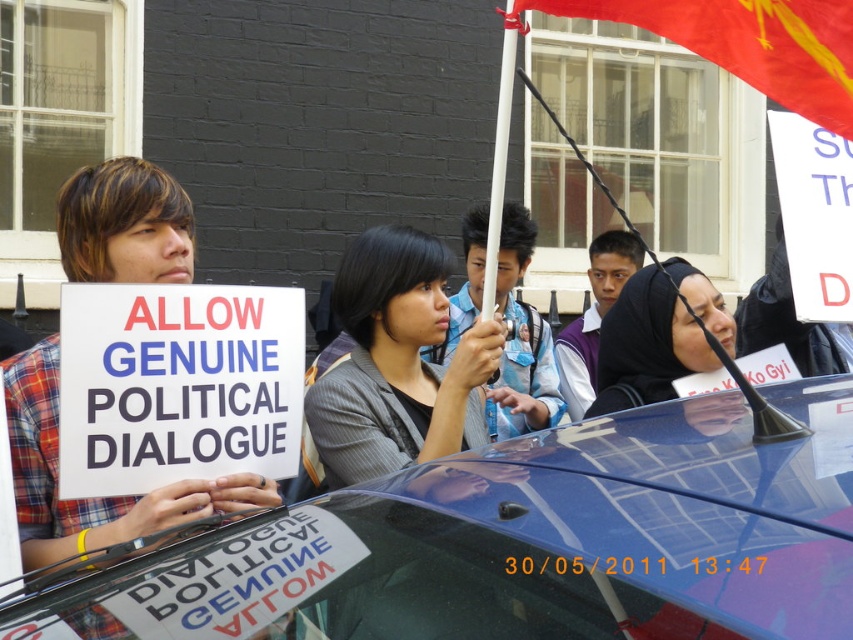
Question: Estimate the real-world distances between objects in this image. Which object is farther from the gray textured blazer at center?

Choices:
 (A) red fabric flag at upper right
 (B) matte black hijab at center

Answer: (A)

Question: In this image, where is shiny blue car at center located relative to matte black hijab at center?

Choices:
 (A) left
 (B) right

Answer: (A)

Question: Which point is closer to the camera taking this photo?

Choices:
 (A) (660, 298)
 (B) (396, 401)
 (C) (782, 10)

Answer: (C)

Question: Does red fabric flag at upper right appear on the right side of matte black hijab at center?

Choices:
 (A) no
 (B) yes

Answer: (A)

Question: Where is shiny blue car at center located in relation to gray textured blazer at center in the image?

Choices:
 (A) left
 (B) right

Answer: (B)

Question: Which object is closer to the camera taking this photo?

Choices:
 (A) shiny blue car at center
 (B) red fabric flag at upper right
 (C) matte black hijab at center

Answer: (A)